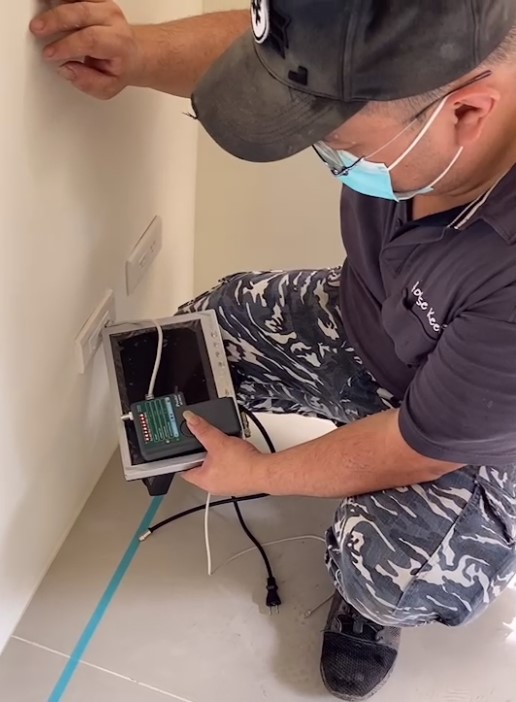
Identify the location of floor. (155, 651).